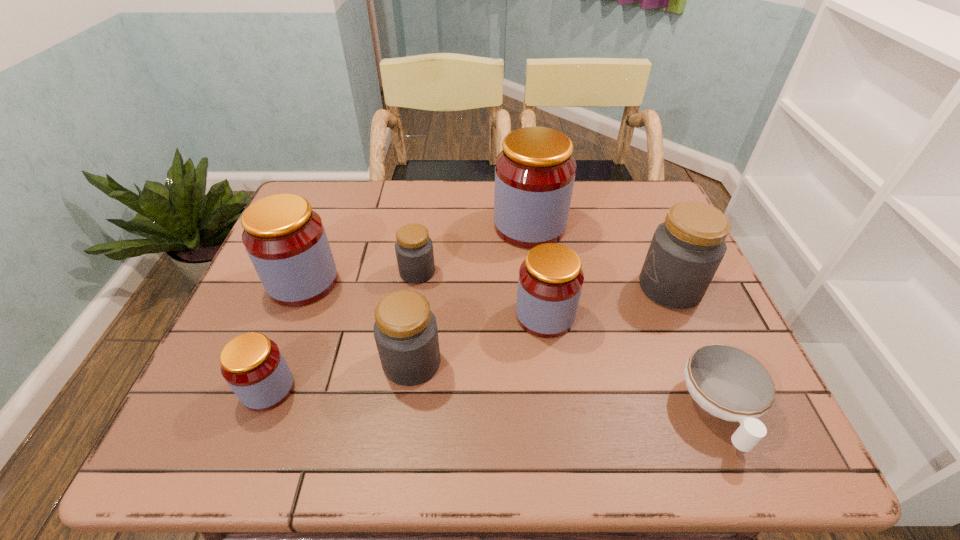
Where is `the farthest red jar`? This screenshot has width=960, height=540. the farthest red jar is located at coordinates (534, 173).

Identify the location of the farthest jar. (534, 173).

I want to click on the biggest gray jar, so (686, 250).

Find the location of a particular element. The height and width of the screenshot is (540, 960). the rightmost jar is located at coordinates (686, 250).

Identify the location of the third smallest red jar. The image size is (960, 540). (285, 239).

The image size is (960, 540). I want to click on the second smallest gray jar, so click(405, 330).

Where is `the second smallest red jar`? Image resolution: width=960 pixels, height=540 pixels. the second smallest red jar is located at coordinates (550, 281).

Where is `the smallest gray jar`? Image resolution: width=960 pixels, height=540 pixels. the smallest gray jar is located at coordinates [414, 249].

Where is `the smallest red jar`? The width and height of the screenshot is (960, 540). the smallest red jar is located at coordinates (253, 366).

The image size is (960, 540). I want to click on chinaware, so (727, 382).